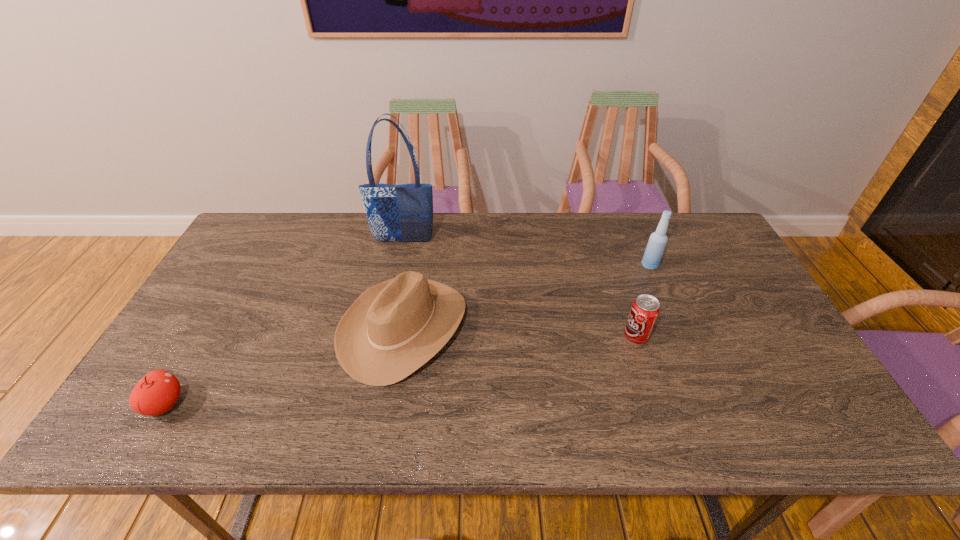
Identify the location of free space that satisfies the following two spatial constraints: 1. on the front-facing side of the soda; 2. on the right side of the shopping bag. (384, 336).

This screenshot has width=960, height=540. I want to click on free spot that satisfies the following two spatial constraints: 1. on the front-facing side of the shopping bag; 2. on the right side of the second object from right to left, so click(x=384, y=336).

At what (x,y) coordinates should I click in order to perform the action: click on vacant space that satisfies the following two spatial constraints: 1. on the front-facing side of the soda; 2. on the left side of the tallest object. Please return your answer as a coordinate pair (x, y). The image size is (960, 540). Looking at the image, I should click on (384, 336).

This screenshot has height=540, width=960. I want to click on vacant region that satisfies the following two spatial constraints: 1. on the front-facing side of the tallest object; 2. on the right side of the cowboy hat, so tap(386, 327).

Where is `vacant region that satisfies the following two spatial constraints: 1. on the back side of the fourth shortest object; 2. on the left side of the soda`? The width and height of the screenshot is (960, 540). vacant region that satisfies the following two spatial constraints: 1. on the back side of the fourth shortest object; 2. on the left side of the soda is located at coordinates (612, 265).

I want to click on vacant point that satisfies the following two spatial constraints: 1. on the front-facing side of the bottle; 2. on the left side of the shopping bag, so click(398, 265).

At what (x,y) coordinates should I click in order to perform the action: click on free space that satisfies the following two spatial constraints: 1. on the front-facing side of the fourth object from left to right; 2. on the left side of the shopping bag. Please return your answer as a coordinate pair (x, y). Looking at the image, I should click on (384, 336).

Find the location of a particular element. The image size is (960, 540). free space in the image that satisfies the following two spatial constraints: 1. on the front-facing side of the soda; 2. on the right side of the shopping bag is located at coordinates (384, 336).

Where is `free spot that satisfies the following two spatial constraints: 1. on the back side of the soda; 2. on the left side of the fourth shortest object`? This screenshot has height=540, width=960. free spot that satisfies the following two spatial constraints: 1. on the back side of the soda; 2. on the left side of the fourth shortest object is located at coordinates (612, 265).